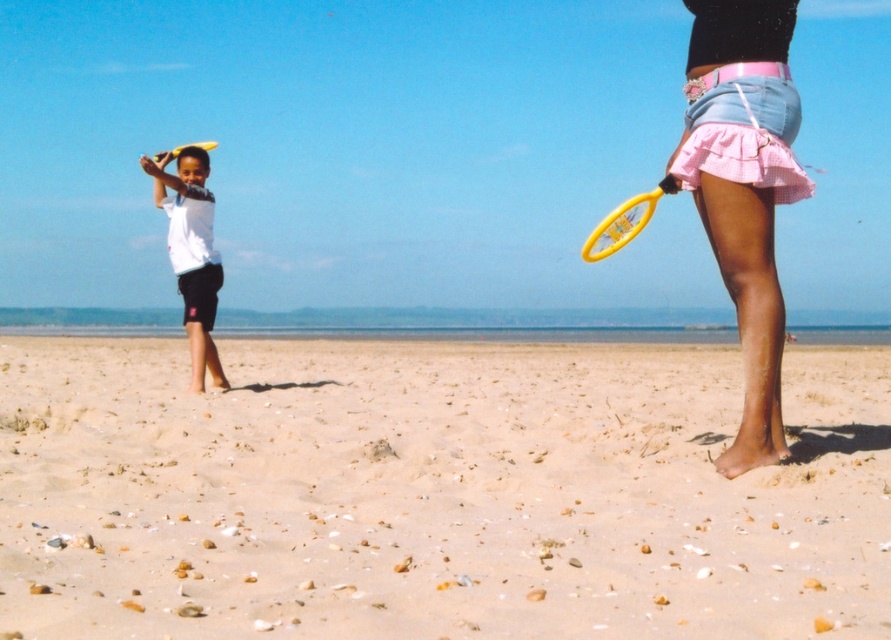
Is white matte shirt at left further to the viewer compared to yellow plastic frisbee at left?

No.

Can you confirm if white matte shirt at left is positioned to the left of yellow plastic frisbee at left?

Incorrect, white matte shirt at left is not on the left side of yellow plastic frisbee at left.

This screenshot has height=640, width=891. Describe the element at coordinates (191, 252) in the screenshot. I see `white matte shirt at left` at that location.

The height and width of the screenshot is (640, 891). What are the coordinates of `white matte shirt at left` in the screenshot? It's located at (191, 252).

Between point (178, 209) and point (654, 202), which one is positioned behind?

The point (178, 209) is behind.

From the picture: Can you confirm if white matte shirt at left is bigger than yellow plastic tennis racket at right?

Incorrect, white matte shirt at left is not larger than yellow plastic tennis racket at right.

Locate an element on the screen. white matte shirt at left is located at coordinates (191, 252).

Identify the location of pink denim skirt at right. (742, 193).

Who is more distant from viewer, (707, 74) or (199, 148)?

The point (199, 148) is more distant.

Which is in front, point (693, 35) or point (170, 157)?

Point (693, 35) is more forward.

At what (x,y) coordinates should I click in order to perform the action: click on pink denim skirt at right. Please return your answer as a coordinate pair (x, y). The height and width of the screenshot is (640, 891). Looking at the image, I should click on pyautogui.click(x=742, y=193).